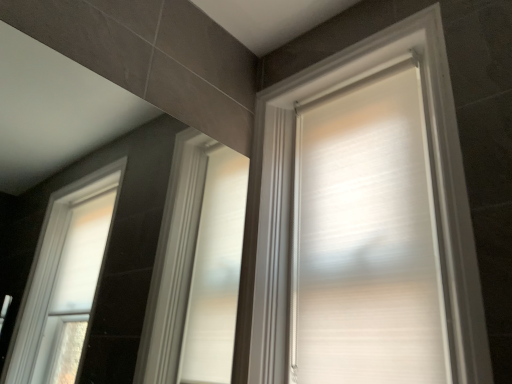
Describe the element at coordinates (432, 185) in the screenshot. This screenshot has width=512, height=384. I see `white textured roller blind at center` at that location.

What are the coordinates of `white textured roller blind at center` in the screenshot? It's located at coord(432,185).

At what (x,y) coordinates should I click in order to perform the action: click on white textured roller blind at center. Please return your answer as a coordinate pair (x, y). The width and height of the screenshot is (512, 384). Looking at the image, I should click on (432, 185).